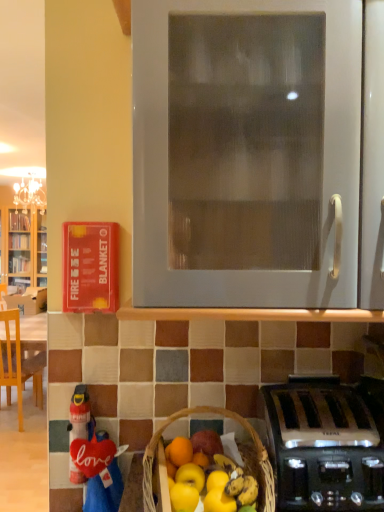
Question: Does white matte oven at center have a greater height compared to wooden chair at left?

Choices:
 (A) yes
 (B) no

Answer: (B)

Question: Is white matte oven at center not near wooden chair at left?

Choices:
 (A) no
 (B) yes

Answer: (B)

Question: Does white matte oven at center lie in front of wooden chair at left?

Choices:
 (A) no
 (B) yes

Answer: (B)

Question: Is white matte oven at center turned away from wooden chair at left?

Choices:
 (A) yes
 (B) no

Answer: (B)

Question: Is white matte oven at center shorter than wooden chair at left?

Choices:
 (A) yes
 (B) no

Answer: (A)

Question: From a real-world perspective, is white matte oven at center physically above wooden chair at left?

Choices:
 (A) no
 (B) yes

Answer: (B)

Question: From a real-world perspective, is satin silver toaster at lower right over wooden chair at left?

Choices:
 (A) no
 (B) yes

Answer: (B)

Question: Can you confirm if satin silver toaster at lower right is bigger than wooden chair at left?

Choices:
 (A) no
 (B) yes

Answer: (A)

Question: From the image's perspective, is satin silver toaster at lower right on wooden chair at left?

Choices:
 (A) yes
 (B) no

Answer: (A)

Question: Would you consider satin silver toaster at lower right to be distant from wooden chair at left?

Choices:
 (A) yes
 (B) no

Answer: (A)

Question: Can you confirm if satin silver toaster at lower right is wider than wooden chair at left?

Choices:
 (A) no
 (B) yes

Answer: (A)

Question: Is satin silver toaster at lower right to the right of wooden chair at left from the viewer's perspective?

Choices:
 (A) yes
 (B) no

Answer: (A)

Question: Can red fabric love sign at lower left be found inside white matte oven at center?

Choices:
 (A) no
 (B) yes

Answer: (A)